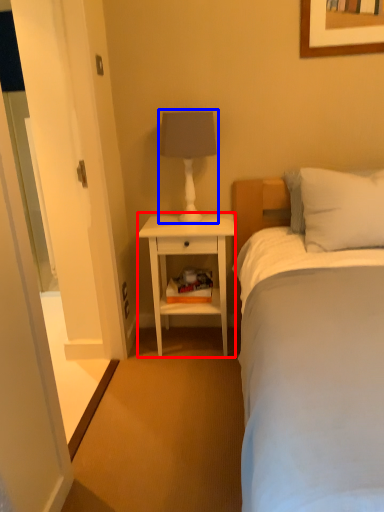
Question: Which point is further to the camera, nightstand (highlighted by a red box) or table lamp (highlighted by a blue box)?

Choices:
 (A) nightstand
 (B) table lamp

Answer: (A)